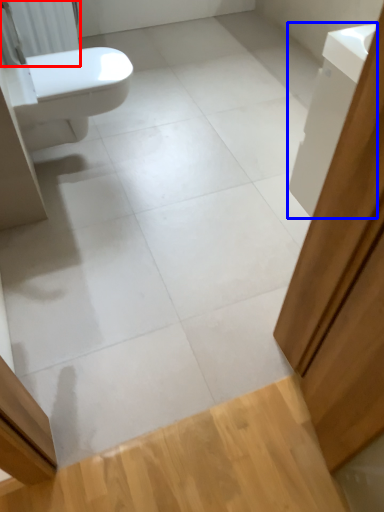
Question: Which object is closer to the camera taking this photo, radiator (highlighted by a red box) or cabinetry (highlighted by a blue box)?

Choices:
 (A) radiator
 (B) cabinetry

Answer: (B)